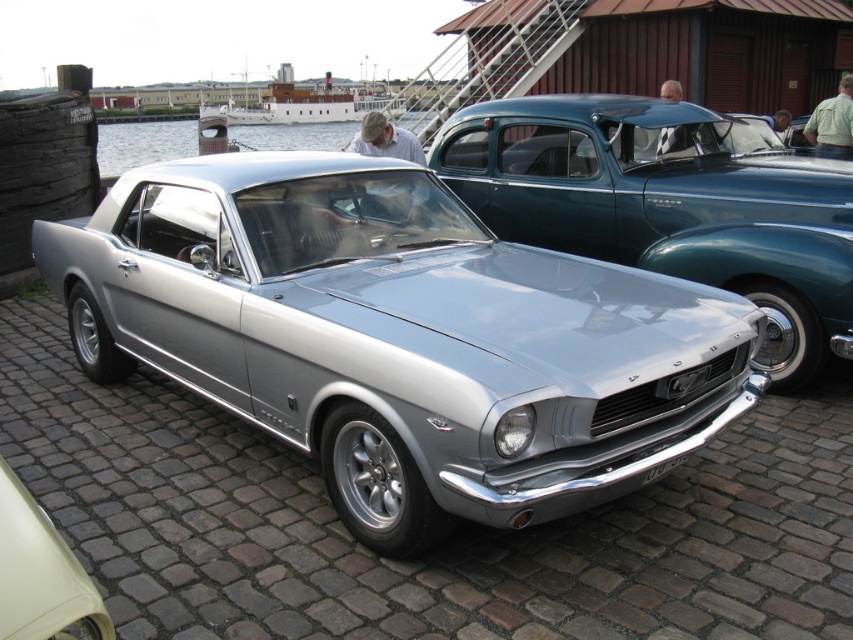
You are a photographer at the classic car event. You want to take a photo of the silver metallic car at center and the white plastic license plate at lower center. Which object should you focus on first if you want to capture both in the same frame without moving the camera?

The silver metallic car at center is bigger than the white plastic license plate at lower center, so you should focus on the silver metallic car at center first to ensure it fills the frame appropriately while still capturing the smaller license plate in the background.

You are a photographer planning to capture both the silver metallic car at center and the white wooden boat at upper center in a single shot. Based on their heights, which object should you position closer to the camera to ensure both are fully visible in the frame?

The silver metallic car at center is not as tall as the white wooden boat at upper center, so you should position the silver metallic car at center closer to the camera to ensure both are fully visible in the frame.

You are a photographer standing in front of the silver metallic car at center and the white plastic license plate at lower center. You want to take a photo that focuses on the license plate without the car blocking it. Is this possible given their positions?

The silver metallic car at center is closer to the viewer than the white plastic license plate at lower center, so the car would block the license plate in the photo unless you move your position to get a clear angle.